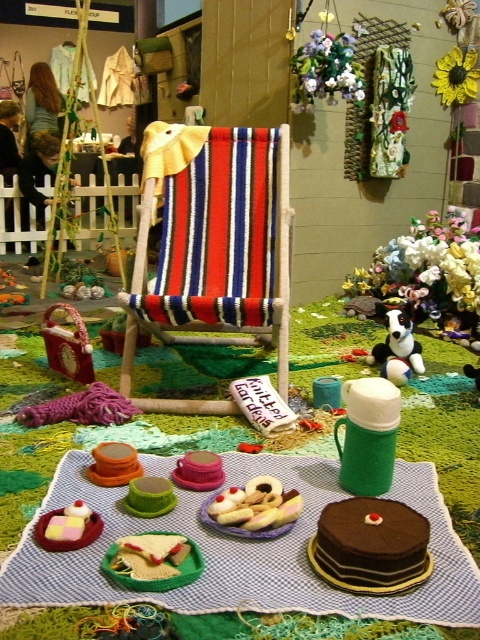
You are looking at the miniature scene and want to place a tiny decorative flag exactly halfway between the two points, point (242, 497) and point (412, 369). Given that the flag needs to be placed at a position that is equidistant from both points, where should you place it?

The flag should be placed at the midpoint between point (242, 497) and point (412, 369). Since the points are in coordinate form, the midpoint can be calculated by averaging their x and y coordinates. The midpoint would be at x coordinate 0.777 and 0.577 divided by 2, which is 0.677, and y coordinate 0.506 and 0.860 divided by 2, which is 0.683. Therefore, the flag should be placed at point 0.677, 0.683.

You are setting up a miniature display and want to place the smooth white cream puff at center and the black plush dog at center so that they are both visible. Based on their current positions, which object is blocking the view of the other?

The black plush dog at center is blocking the view of the smooth white cream puff at center because it is positioned over it.